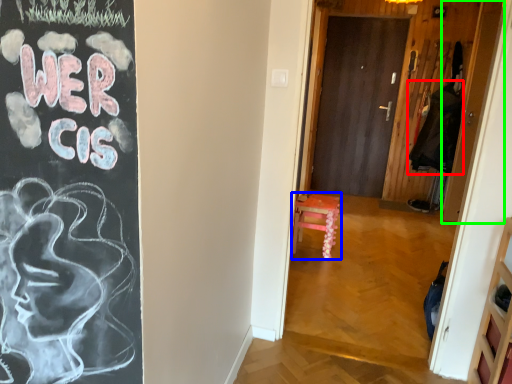
Question: Based on their relative distances, which object is farther from garment (highlighted by a red box)? Choose from furniture (highlighted by a blue box) and door (highlighted by a green box).

Choices:
 (A) furniture
 (B) door

Answer: (A)